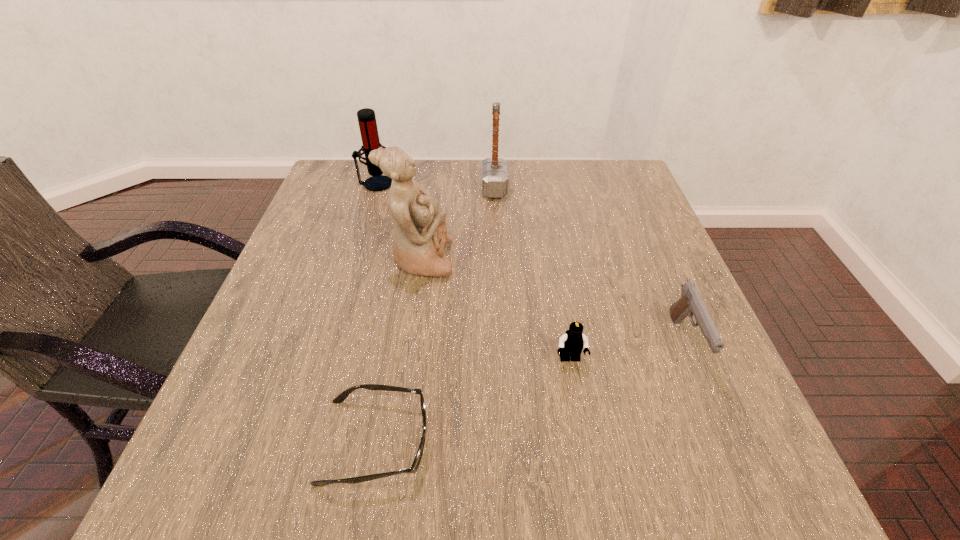
Locate an element on the screen. This screenshot has width=960, height=540. free spot located 0.320m on the striking surface of the fourth object from left to right is located at coordinates (368, 188).

Image resolution: width=960 pixels, height=540 pixels. I want to click on free space located on the right of the microphone, so (x=453, y=184).

At what (x,y) coordinates should I click in order to perform the action: click on vacant area situated 0.160m at the barrel of the pistol. Please return your answer as a coordinate pair (x, y). The image size is (960, 540). Looking at the image, I should click on (738, 470).

Identify the location of vacant space positioned on the front-facing side of the Lego. (576, 392).

Where is `vacant space located 0.070m on the front-facing side of the nearest object`? vacant space located 0.070m on the front-facing side of the nearest object is located at coordinates (472, 441).

At what (x,y) coordinates should I click in order to perform the action: click on hammer that is at the far edge. Please return your answer as a coordinate pair (x, y). Looking at the image, I should click on (494, 170).

Where is `microphone situated at the far edge`? The width and height of the screenshot is (960, 540). microphone situated at the far edge is located at coordinates (366, 117).

Where is `object that is at the near edge`? This screenshot has height=540, width=960. object that is at the near edge is located at coordinates (340, 398).

Find the location of `object at the left edge`. object at the left edge is located at coordinates (366, 117).

Locate an element on the screen. The image size is (960, 540). object present at the right edge is located at coordinates (690, 303).